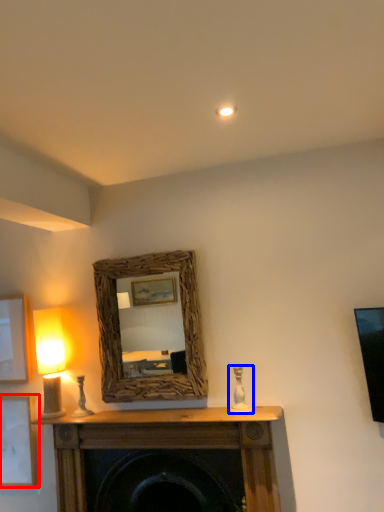
Question: Which object is closer to the camera taking this photo, picture frame (highlighted by a red box) or candle holder (highlighted by a blue box)?

Choices:
 (A) picture frame
 (B) candle holder

Answer: (B)